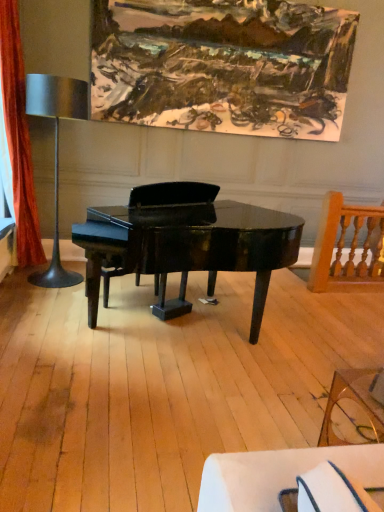
Locate an element on the screen. Image resolution: width=384 pixels, height=512 pixels. vacant area situated below glossy black piano at center (from a real-world perspective) is located at coordinates (192, 337).